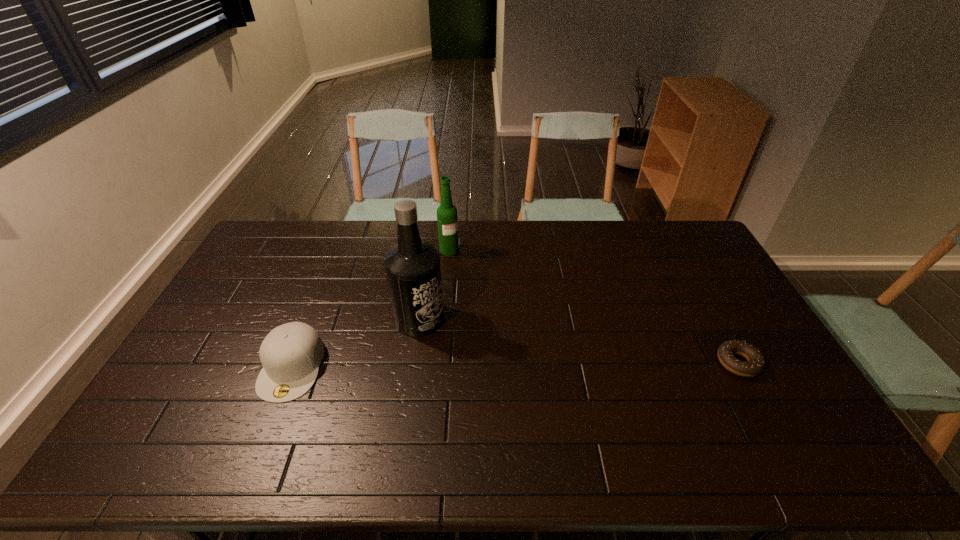
Locate an element on the screen. vacant space at the left edge of the desktop is located at coordinates (242, 350).

At what (x,y) coordinates should I click in order to perform the action: click on vacant region at the right edge of the desktop. Please return your answer as a coordinate pair (x, y). The height and width of the screenshot is (540, 960). Looking at the image, I should click on (760, 331).

Locate an element on the screen. Image resolution: width=960 pixels, height=540 pixels. blank space at the far left corner of the desktop is located at coordinates (265, 254).

Locate an element on the screen. The width and height of the screenshot is (960, 540). free location at the far right corner is located at coordinates (680, 231).

Identify the location of empty location between the farthest object and the doughnut. [593, 306].

Locate an element on the screen. The width and height of the screenshot is (960, 540). unoccupied position between the farthest object and the third tallest object is located at coordinates (371, 308).

Find the location of a particular element. The width and height of the screenshot is (960, 540). empty space that is in between the third tallest object and the doughnut is located at coordinates (515, 364).

You are a GUI agent. You are given a task and a screenshot of the screen. Output one action in this format:
    pyautogui.click(x=<x>, y=<y>)
    Task: Click on the unoccupied position between the second shortest object and the beer bottle
    The width and height of the screenshot is (960, 540).
    Given the screenshot: What is the action you would take?
    pyautogui.click(x=371, y=308)

The image size is (960, 540). What are the coordinates of `vacant point located between the third tallest object and the doughnut` in the screenshot? It's located at (515, 364).

Find the location of a particular element. Image resolution: width=960 pixels, height=540 pixels. vacant space that is in between the cap and the rightmost object is located at coordinates (515, 364).